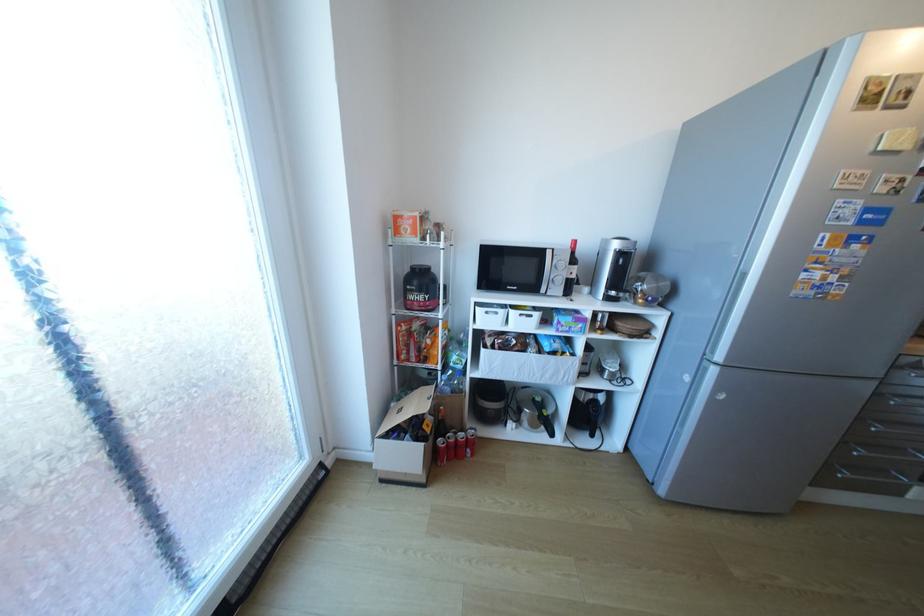
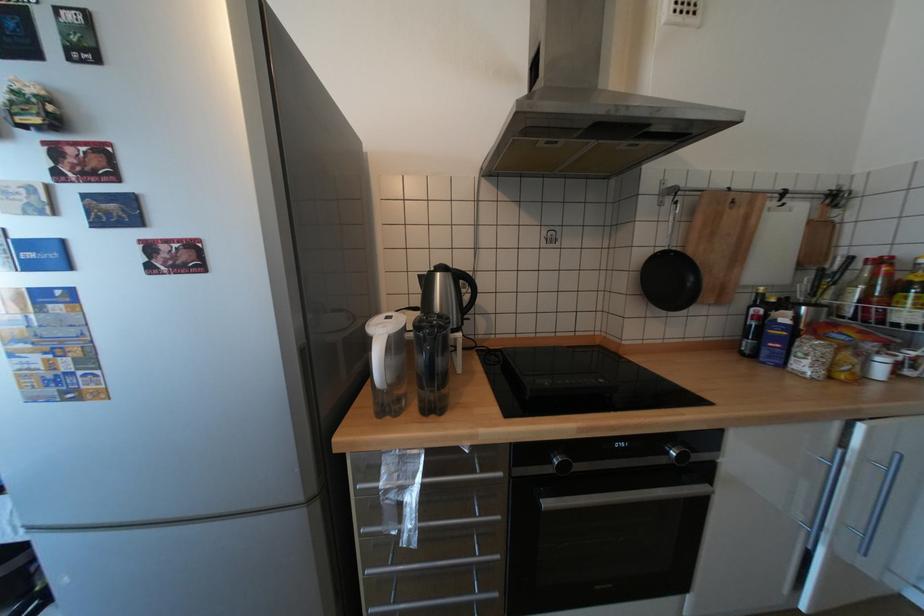
Question: What movement of the cameraman would produce the second image?

Choices:
 (A) Left
 (B) Right
 (C) Forward
 (D) Backward

Answer: (B)